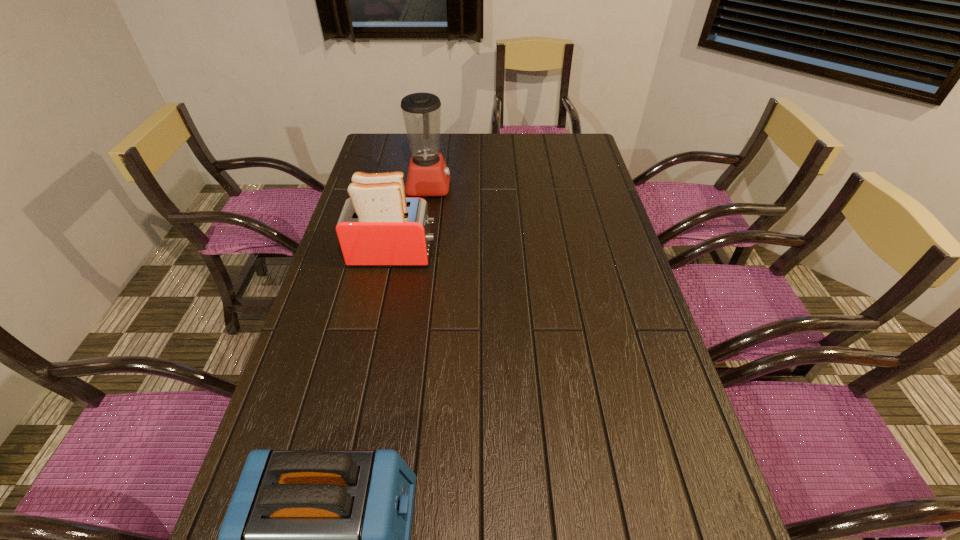
At what (x,y) coordinates should I click in order to perform the action: click on object that stands as the second closest to the nearer toaster. Please return your answer as a coordinate pair (x, y). The height and width of the screenshot is (540, 960). Looking at the image, I should click on tap(428, 175).